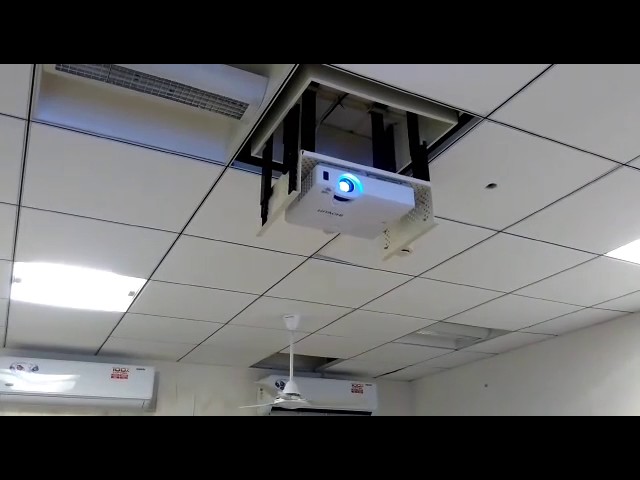
At what (x,y) coordinates should I click in order to perform the action: click on mounted air condictioners. Please return your answer as a coordinate pair (x, y). This screenshot has height=480, width=640. Looking at the image, I should click on (336, 404), (105, 394).